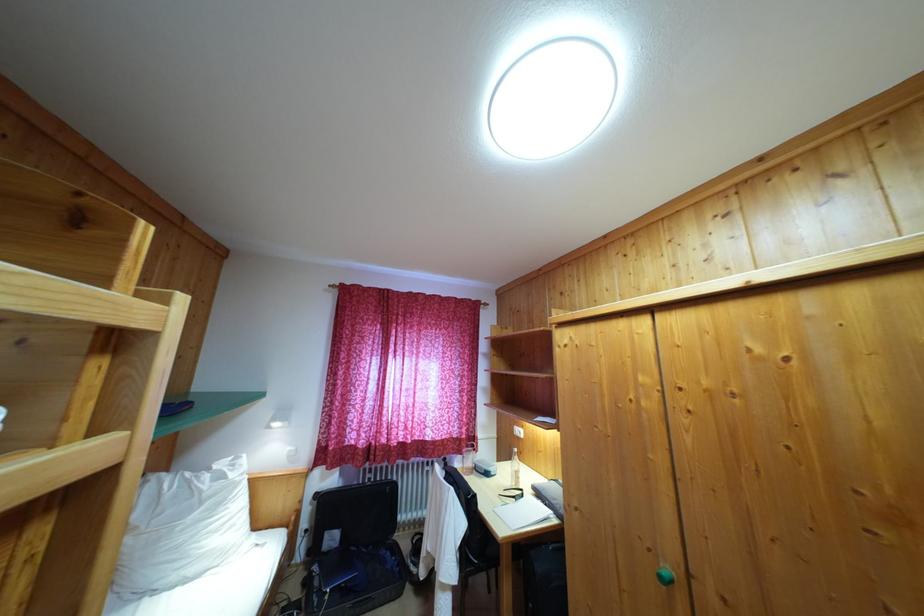
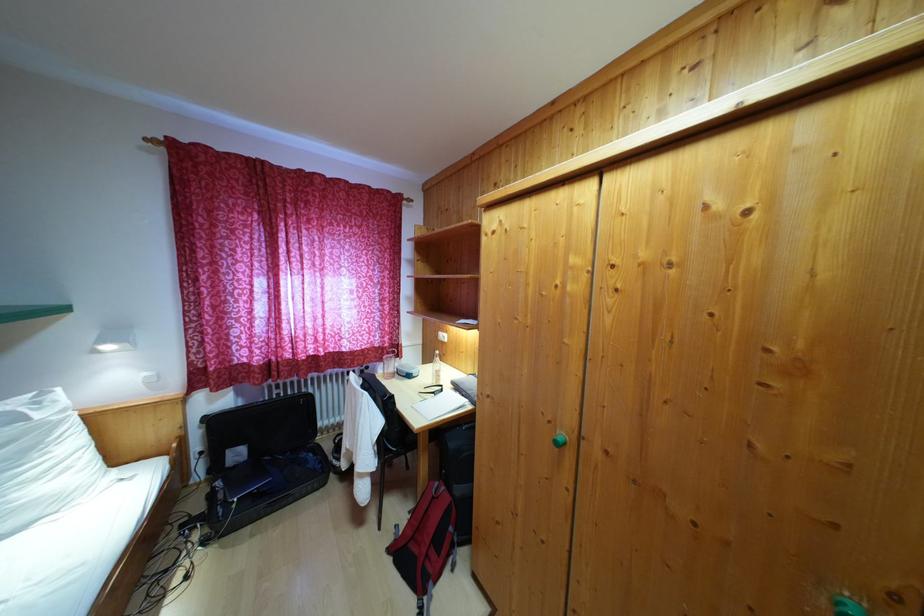
The first image is from the beginning of the video and the second image is from the end. How did the camera likely rotate when shooting the video?

The rotation direction of the camera is right-down.